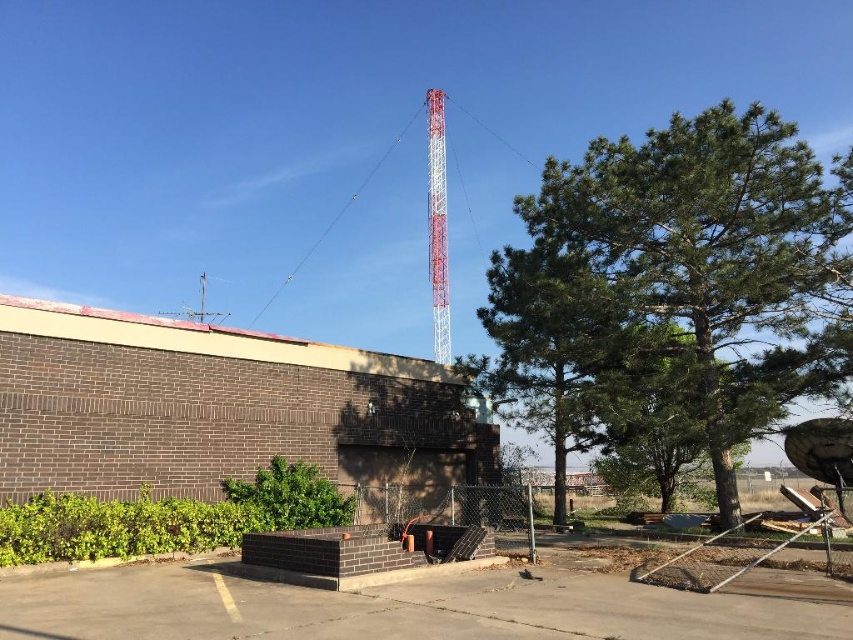
You are standing at the base of the tall red and white striped tower and want to walk to the metallic pole at center. There is a green leafy tree at center blocking your path. Can you walk around the tree to reach the pole without going off the path?

The green leafy tree at center is 15.73 feet away from the metallic pole at center, so you can walk around the tree to reach the pole as long as you stay within the path.

Based on the photo, you are standing in the area and want to take a photo of the metallic red tower at upper center and the metallic pole at center. Which object should you focus on first if you want to capture both in a single frame without moving the camera?

You should focus on the metallic red tower at upper center first because it is above the metallic pole at center, so adjusting the camera to include the higher object first ensures both are in frame.